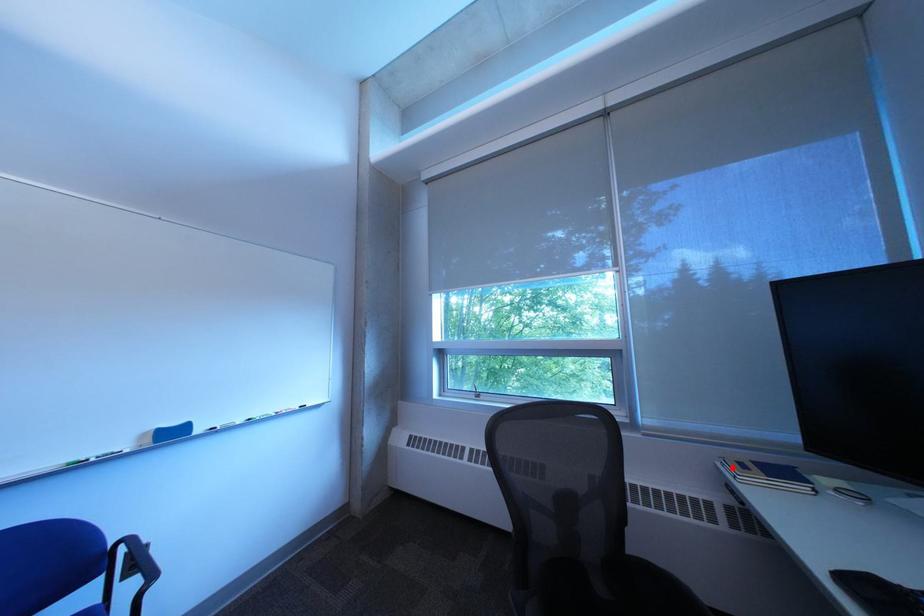
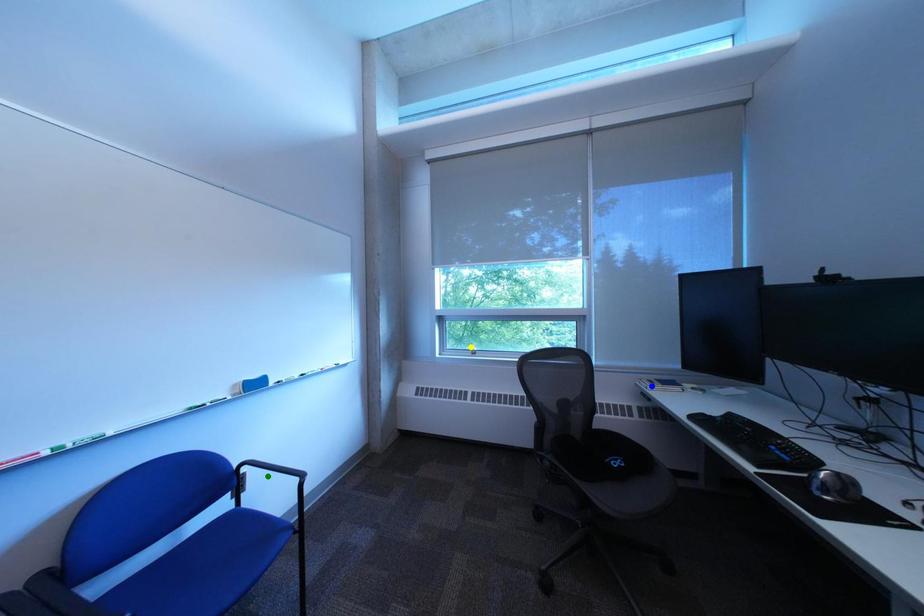
Question: I am providing you with two images of the same scene from different viewpoints. A red point is marked on the first image. You are given multiple points on the second image. Which point in image 2 is actually the same real-world point as the red point in image 1?

Choices:
 (A) yellow point
 (B) green point
 (C) blue point

Answer: (C)